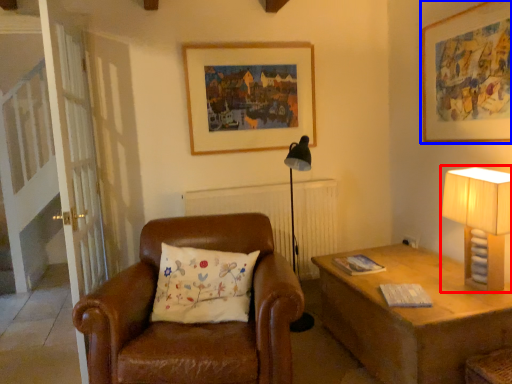
Question: Which object appears closest to the camera in this image, table lamp (highlighted by a red box) or picture frame (highlighted by a blue box)?

Choices:
 (A) table lamp
 (B) picture frame

Answer: (A)